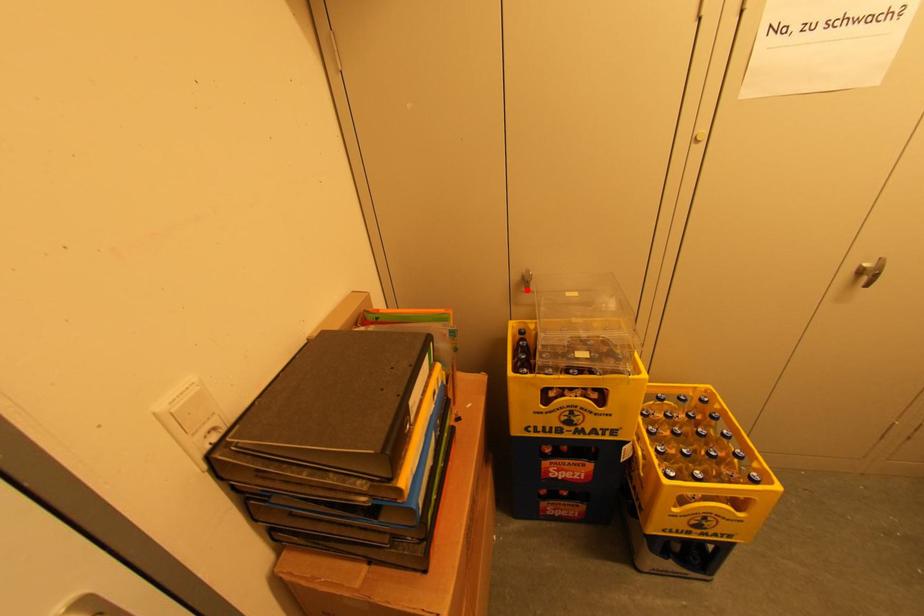
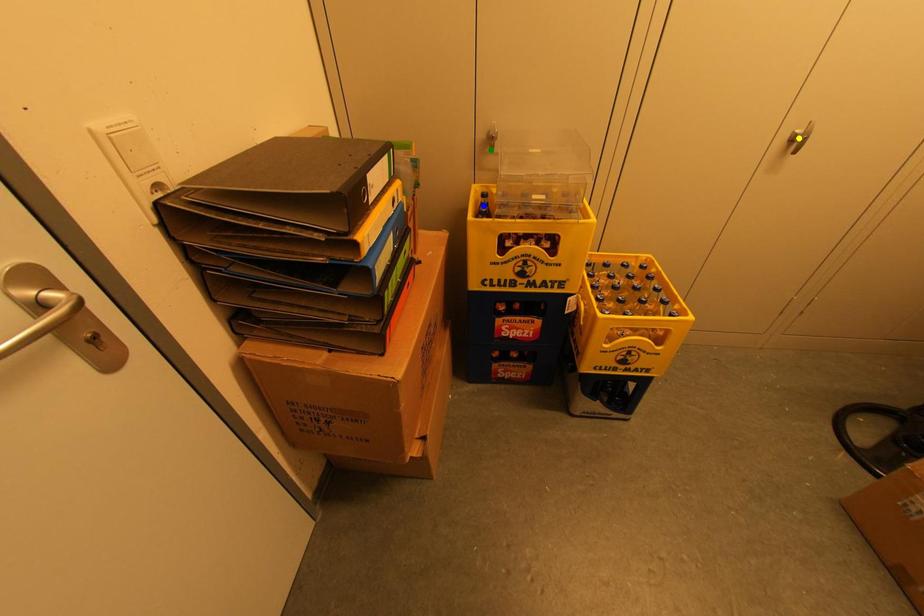
Question: I am providing you with two images of the same scene from different viewpoints. A red point is marked on the first image. You are given multiple points on the second image. In image 2, which mark is for the same physical point as the one in image 1?

Choices:
 (A) green point
 (B) blue point
 (C) yellow point

Answer: (A)